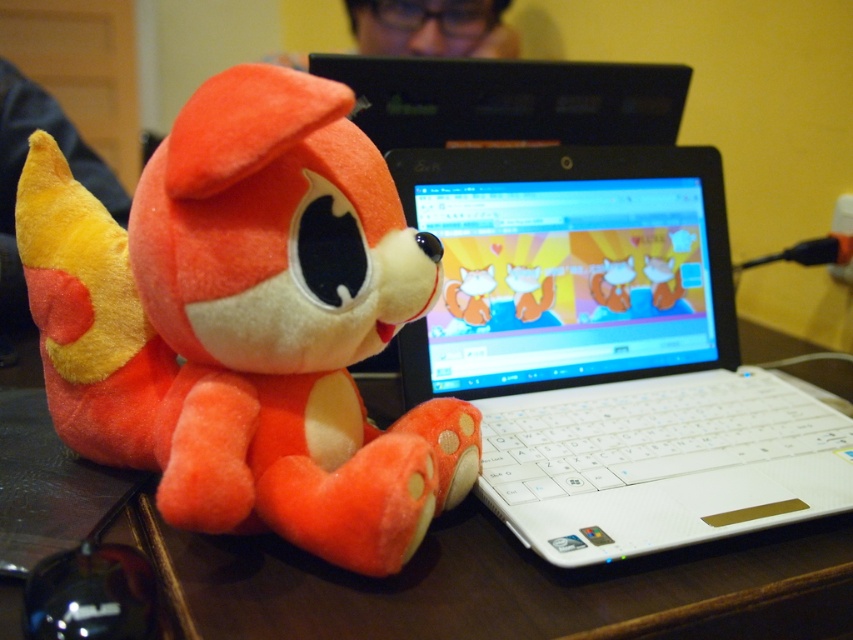
Which is more to the left, wooden table at lower left or matte black laptop at upper center?

Positioned to the left is wooden table at lower left.

Can you confirm if wooden table at lower left is positioned to the left of matte black laptop at upper center?

Indeed, wooden table at lower left is positioned on the left side of matte black laptop at upper center.

This screenshot has height=640, width=853. What do you see at coordinates (502, 586) in the screenshot?
I see `wooden table at lower left` at bounding box center [502, 586].

Locate an element on the screen. Image resolution: width=853 pixels, height=640 pixels. wooden table at lower left is located at coordinates (502, 586).

Does white plastic laptop at center appear under matte black laptop at upper center?

Indeed, white plastic laptop at center is positioned under matte black laptop at upper center.

Is white plastic laptop at center to the right of matte black laptop at upper center from the viewer's perspective?

Correct, you'll find white plastic laptop at center to the right of matte black laptop at upper center.

Is point (706, 456) farther from camera compared to point (509, 83)?

No, (706, 456) is in front of (509, 83).

Image resolution: width=853 pixels, height=640 pixels. Find the location of `white plastic laptop at center`. white plastic laptop at center is located at coordinates (607, 353).

Is fluffy orange plush toy at left behind matte black laptop at upper center?

No, it is not.

Is the position of fluffy orange plush toy at left less distant than that of matte black laptop at upper center?

Yes.

Does point (363, 500) come closer to viewer compared to point (497, 132)?

Yes, it is.

Identify the location of fluffy orange plush toy at left. (257, 324).